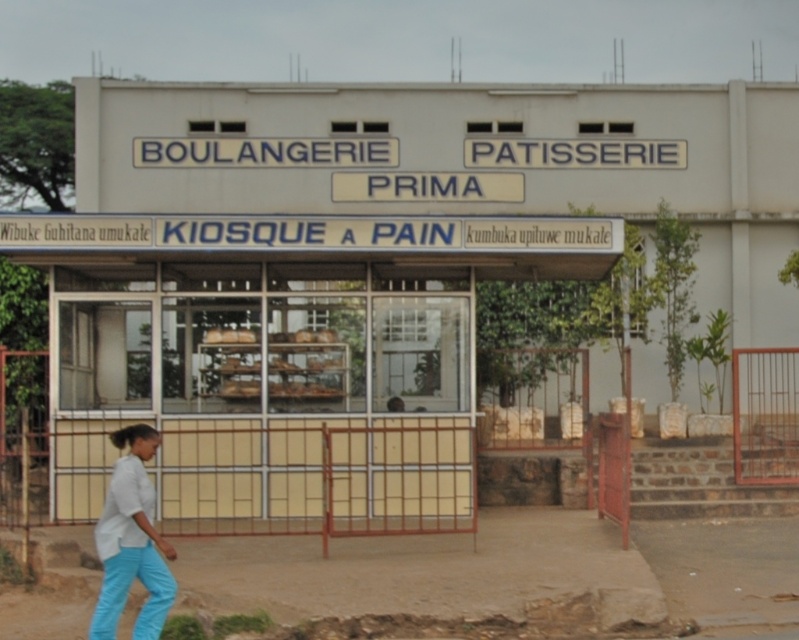
Question: Does matte yellow kiosk at center come in front of white fabric pants at lower left?

Choices:
 (A) no
 (B) yes

Answer: (A)

Question: Is matte yellow kiosk at center wider than white fabric pants at lower left?

Choices:
 (A) no
 (B) yes

Answer: (B)

Question: Can you confirm if matte yellow kiosk at center is positioned above white fabric pants at lower left?

Choices:
 (A) yes
 (B) no

Answer: (A)

Question: Which of the following is the closest to the observer?

Choices:
 (A) matte yellow kiosk at center
 (B) white fabric pants at lower left

Answer: (B)